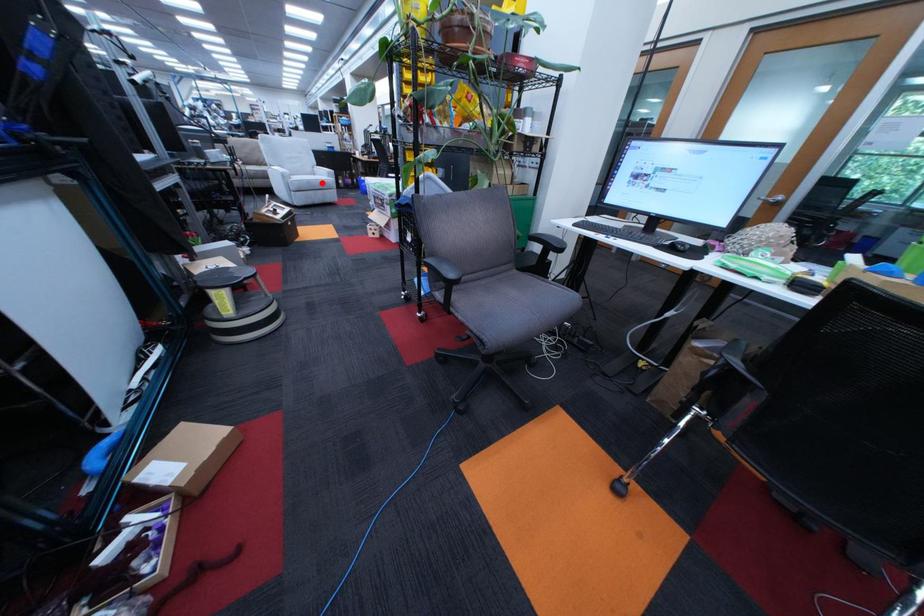
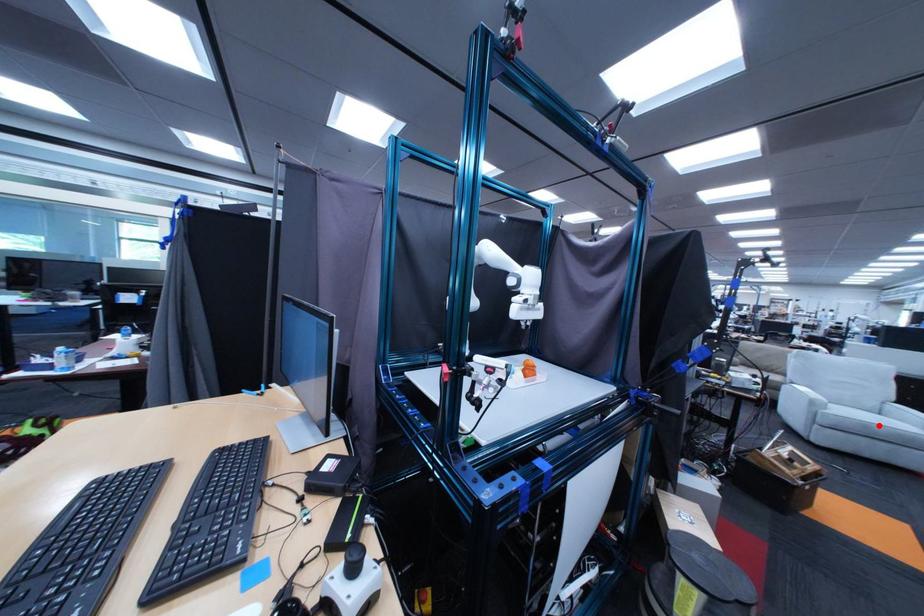
I am providing you with two images of the same scene from different viewpoints. A red point is marked on the first image and another point is marked on the second image. Do the highlighted points in image1 and image2 indicate the same real-world spot?

Yes